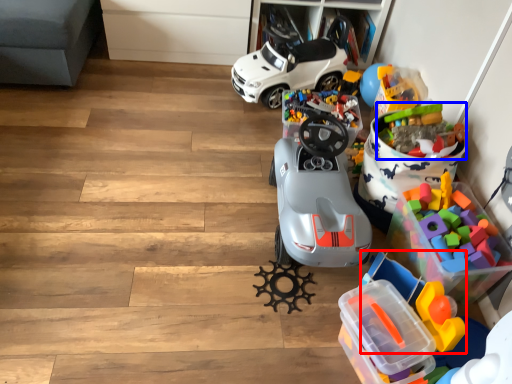
Question: Which of the following is the farthest to the observer, toy (highlighted by a red box) or toy (highlighted by a blue box)?

Choices:
 (A) toy
 (B) toy

Answer: (B)